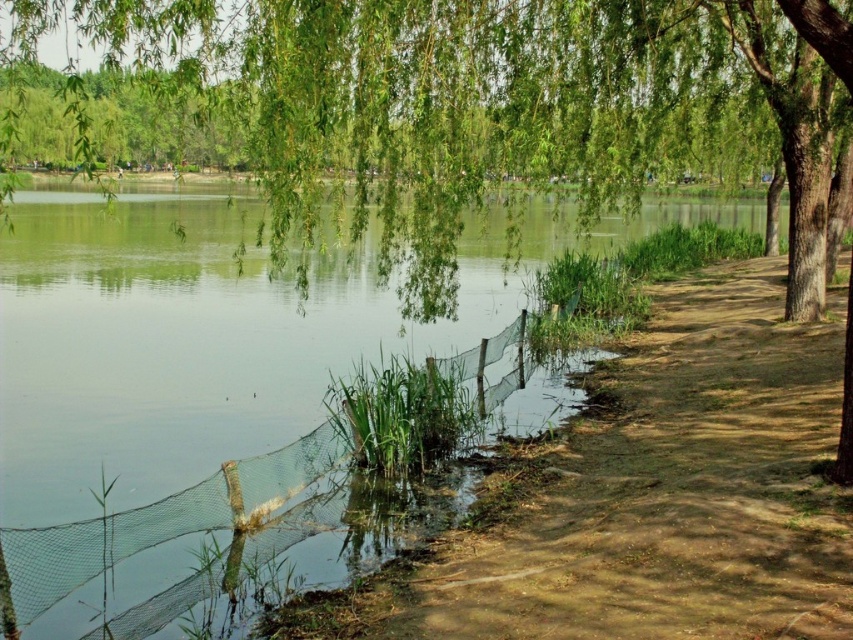
Between green leafy willow at upper center and brown dirt path at lower right, which one is positioned higher?

green leafy willow at upper center is higher up.

The width and height of the screenshot is (853, 640). What do you see at coordinates (459, 108) in the screenshot?
I see `green leafy willow at upper center` at bounding box center [459, 108].

At what (x,y) coordinates should I click in order to perform the action: click on green leafy willow at upper center. Please return your answer as a coordinate pair (x, y). The width and height of the screenshot is (853, 640). Looking at the image, I should click on (459, 108).

Between brown dirt path at lower right and transparent mesh net at lower center, which one appears on the left side from the viewer's perspective?

transparent mesh net at lower center is more to the left.

What do you see at coordinates (671, 492) in the screenshot? The width and height of the screenshot is (853, 640). I see `brown dirt path at lower right` at bounding box center [671, 492].

Where is `brown dirt path at lower right`? This screenshot has width=853, height=640. brown dirt path at lower right is located at coordinates (671, 492).

Locate an element on the screen. brown dirt path at lower right is located at coordinates (671, 492).

Which is above, green leafy willow at upper center or transparent mesh net at lower center?

green leafy willow at upper center is above.

Describe the element at coordinates (459, 108) in the screenshot. The width and height of the screenshot is (853, 640). I see `green leafy willow at upper center` at that location.

Identify the location of green leafy willow at upper center. [x=459, y=108].